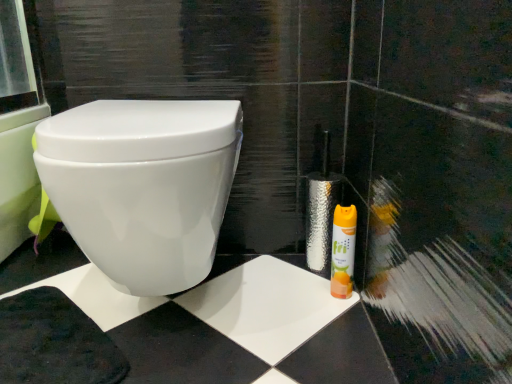
This screenshot has width=512, height=384. Describe the element at coordinates (343, 251) in the screenshot. I see `yellow matte canister at lower right` at that location.

You are a GUI agent. You are given a task and a screenshot of the screen. Output one action in this format:
    pyautogui.click(x=<x>, y=<y>)
    Task: Click on the yellow matte canister at lower right
    The image size is (512, 384).
    Given the screenshot: What is the action you would take?
    pyautogui.click(x=343, y=251)

Where is `white glossy toilet at center`? The height and width of the screenshot is (384, 512). white glossy toilet at center is located at coordinates (143, 186).

What do you see at coordinates (143, 186) in the screenshot? I see `white glossy toilet at center` at bounding box center [143, 186].

Identify the location of yellow matte canister at lower right. (343, 251).

Which is more to the right, white glossy toilet at center or yellow matte canister at lower right?

Positioned to the right is yellow matte canister at lower right.

Consider the image. Is white glossy toilet at center in front of or behind yellow matte canister at lower right in the image?

white glossy toilet at center is in front of yellow matte canister at lower right.

Does point (152, 194) come in front of point (348, 294)?

Yes, point (152, 194) is closer to viewer.

From the image's perspective, is white glossy toilet at center below yellow matte canister at lower right?

Actually, white glossy toilet at center appears above yellow matte canister at lower right in the image.

From a real-world perspective, is white glossy toilet at center below yellow matte canister at lower right?

Actually, white glossy toilet at center is physically above yellow matte canister at lower right in the real world.

Between white glossy toilet at center and yellow matte canister at lower right, which one has larger width?

With larger width is white glossy toilet at center.

In terms of height, does white glossy toilet at center look taller or shorter compared to yellow matte canister at lower right?

white glossy toilet at center is taller than yellow matte canister at lower right.

Considering the relative sizes of white glossy toilet at center and yellow matte canister at lower right in the image provided, is white glossy toilet at center smaller than yellow matte canister at lower right?

No.

Can we say white glossy toilet at center lies outside yellow matte canister at lower right?

Yes.

Is white glossy toilet at center not near yellow matte canister at lower right?

white glossy toilet at center is near yellow matte canister at lower right, not far away.

Is white glossy toilet at center oriented away from yellow matte canister at lower right?

white glossy toilet at center is not turned away from yellow matte canister at lower right.

Can you tell me how much white glossy toilet at center and yellow matte canister at lower right differ in facing direction?

They differ by 0.000597 degrees in their facing directions.

Where is `cleaning product that is below the white glossy toilet at center (from the image's perspective)`? This screenshot has width=512, height=384. cleaning product that is below the white glossy toilet at center (from the image's perspective) is located at coordinates (343, 251).

Would you say yellow matte canister at lower right is to the left or to the right of white glossy toilet at center in the picture?

From the image, it's evident that yellow matte canister at lower right is to the right of white glossy toilet at center.

Which object is more forward, yellow matte canister at lower right or white glossy toilet at center?

white glossy toilet at center is more forward.

Is point (349, 265) farther from viewer compared to point (176, 274)?

Yes, point (349, 265) is farther from viewer.

From the image's perspective, would you say yellow matte canister at lower right is shown under white glossy toilet at center?

Yes, from the image's perspective, yellow matte canister at lower right is below white glossy toilet at center.

From a real-world perspective, between yellow matte canister at lower right and white glossy toilet at center, who is vertically lower?

From a 3D spatial view, yellow matte canister at lower right is below.

Which object is wider, yellow matte canister at lower right or white glossy toilet at center?

white glossy toilet at center is wider.

Considering the sizes of yellow matte canister at lower right and white glossy toilet at center in the image, is yellow matte canister at lower right taller or shorter than white glossy toilet at center?

yellow matte canister at lower right is shorter than white glossy toilet at center.

Consider the image. Based on their sizes in the image, would you say yellow matte canister at lower right is bigger or smaller than white glossy toilet at center?

In the image, yellow matte canister at lower right appears to be smaller than white glossy toilet at center.

Choose the correct answer: Is yellow matte canister at lower right inside white glossy toilet at center or outside it?

yellow matte canister at lower right lies outside white glossy toilet at center.

Are yellow matte canister at lower right and white glossy toilet at center beside each other?

yellow matte canister at lower right and white glossy toilet at center are clearly separated.

In the scene shown: Is yellow matte canister at lower right facing away from white glossy toilet at center?

No.

How many degrees apart are the facing directions of yellow matte canister at lower right and white glossy toilet at center?

They differ by 0.000597 degrees in their facing directions.

Where is `toilet above the yellow matte canister at lower right (from a real-world perspective)`? toilet above the yellow matte canister at lower right (from a real-world perspective) is located at coordinates (143, 186).

The width and height of the screenshot is (512, 384). I want to click on toilet located above the yellow matte canister at lower right (from a real-world perspective), so click(143, 186).

You are a GUI agent. You are given a task and a screenshot of the screen. Output one action in this format:
    pyautogui.click(x=<x>, y=<y>)
    Task: Click on the cleaning product below the white glossy toilet at center (from a real-world perspective)
    Image resolution: width=512 pixels, height=384 pixels.
    Given the screenshot: What is the action you would take?
    pyautogui.click(x=343, y=251)